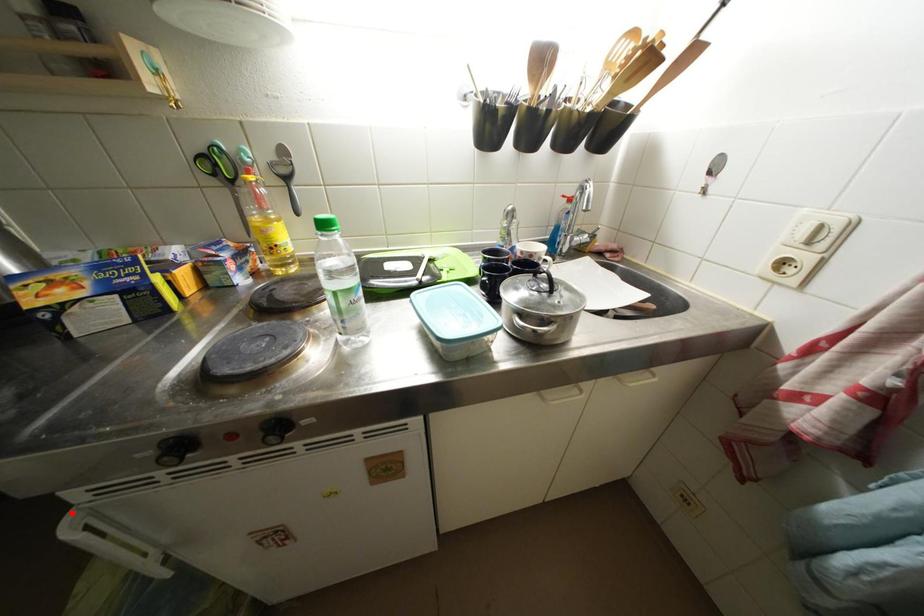
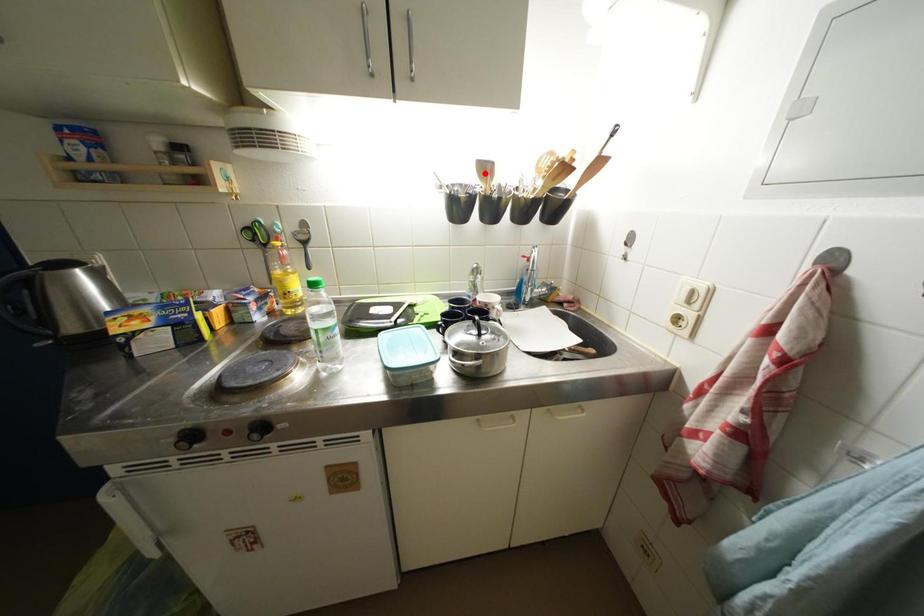
I am providing you with two images of the same scene from different viewpoints. A red point is marked on the first image and another point is marked on the second image. Is the marked point in image1 the same physical position as the marked point in image2?

No